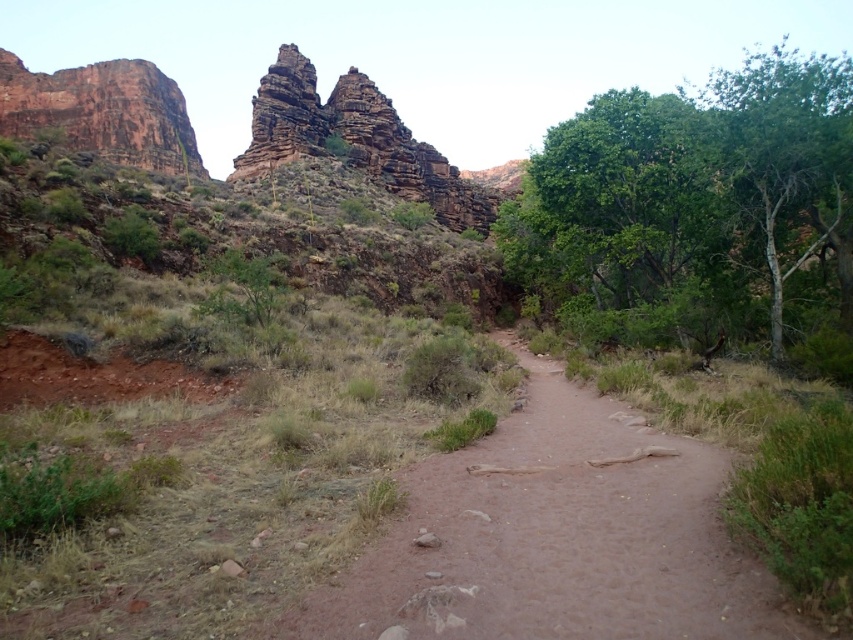
Question: Can you confirm if brown sandy dirt track at center is bigger than green leafy tree at right?

Choices:
 (A) yes
 (B) no

Answer: (B)

Question: Is green leafy tree at right to the left of rustic stone formation at upper center from the viewer's perspective?

Choices:
 (A) no
 (B) yes

Answer: (A)

Question: Which point is farther from the camera taking this photo?

Choices:
 (A) (161, 108)
 (B) (814, 65)
 (C) (410, 611)
 (D) (277, 96)

Answer: (A)

Question: Does rustic stone formation at upper center have a lesser width compared to reddish-brown rock formation at upper left?

Choices:
 (A) no
 (B) yes

Answer: (B)

Question: Which point is closer to the camera?

Choices:
 (A) rustic stone formation at upper center
 (B) reddish-brown rock formation at upper left
 (C) brown sandy dirt track at center
 (D) green leafy tree at right

Answer: (C)

Question: Which object is positioned closest to the brown sandy dirt track at center?

Choices:
 (A) reddish-brown rock formation at upper left
 (B) rustic stone formation at upper center

Answer: (B)